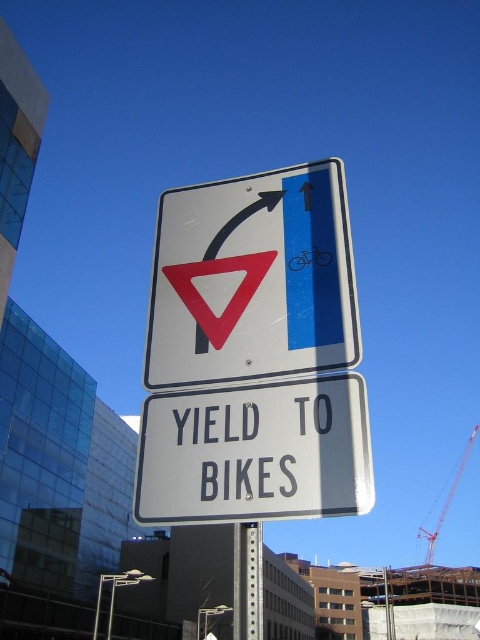
You are a driver approaching an intersection and see the metallic silver sign at center and the red metal crane at upper right. Which object is closer to you?

The metallic silver sign at center is closer to you because it is in front of the red metal crane at upper right.

You are a cyclist approaching an intersection and see the metallic silver sign at center. Based on its position, can you determine if it is placed to your left or right side?

The metallic silver sign at center is located at point coordinates which do not provide directional information from the cyclist perspective. Without knowing the cyclist position relative to the sign, it is impossible to determine left or right side placement.

You are a city planner analyzing the traffic signs in the image. The scene includes a metallic silver sign at center and a red metal crane at upper right. Which object takes up more visual space in the image?

The red metal crane at upper right takes up more visual space than the metallic silver sign at center because the metallic silver sign at center occupies less space than red metal crane at upper right.